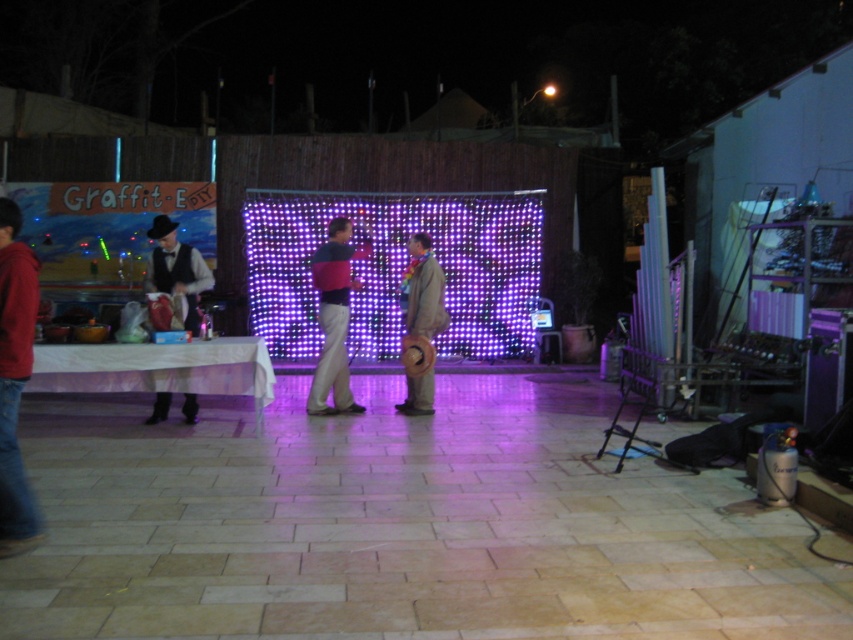
Question: Estimate the real-world distances between objects in this image. Which object is farther from the matte black vest at left?

Choices:
 (A) brown suede hat at center
 (B) red hoodie at left
 (C) smooth stone floor at center
 (D) matte pink sweater at center

Answer: (B)

Question: Can you confirm if smooth stone floor at center is thinner than red hoodie at left?

Choices:
 (A) yes
 (B) no

Answer: (B)

Question: Which point appears farthest from the camera in this image?

Choices:
 (A) (428, 253)
 (B) (346, 268)

Answer: (A)

Question: Considering the real-world distances, which object is farthest from the brown suede hat at center?

Choices:
 (A) matte pink sweater at center
 (B) matte black vest at left
 (C) red hoodie at left

Answer: (C)

Question: Does matte pink sweater at center have a greater width compared to brown suede hat at center?

Choices:
 (A) no
 (B) yes

Answer: (B)

Question: Can you confirm if smooth stone floor at center is positioned above brown suede hat at center?

Choices:
 (A) no
 (B) yes

Answer: (A)